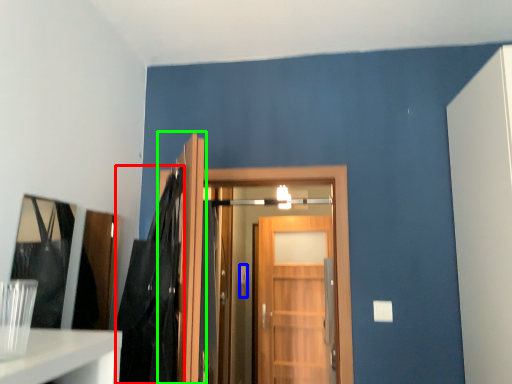
Question: Which object is the closest to the dark (highlighted by a red box)? Choose among these: door handle (highlighted by a blue box) or door (highlighted by a green box).

Choices:
 (A) door handle
 (B) door

Answer: (B)